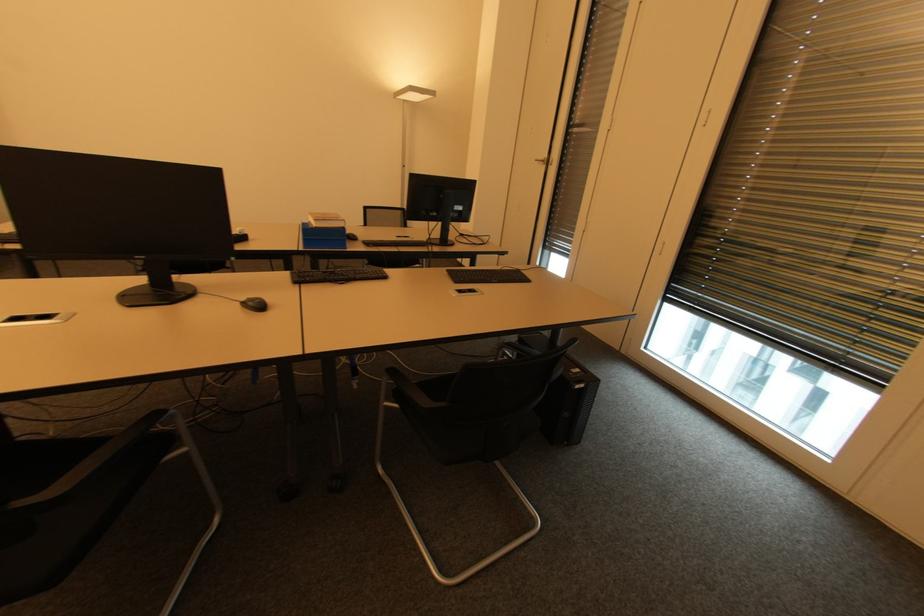
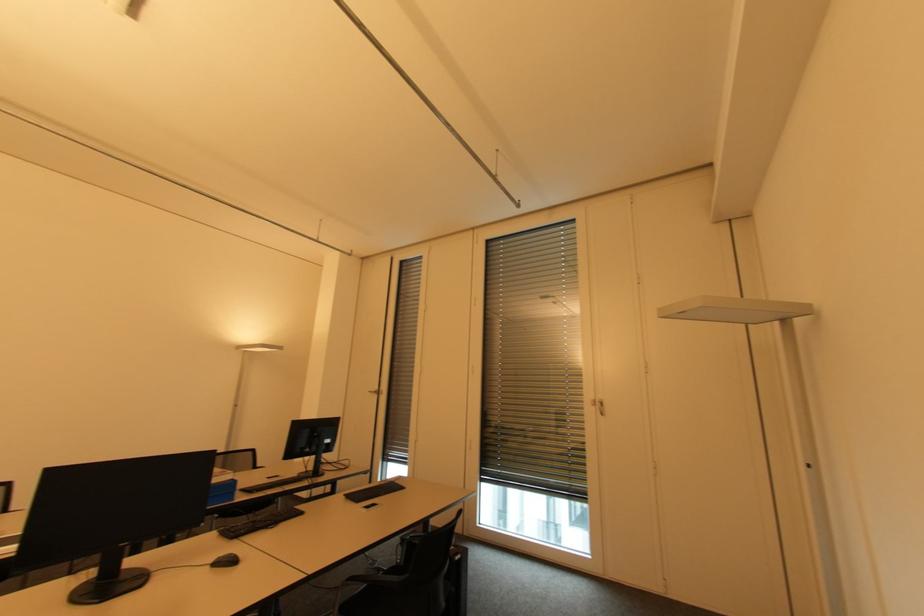
Where in the second image is the point corresponding to pixel 386 274 from the first image?

(300, 511)